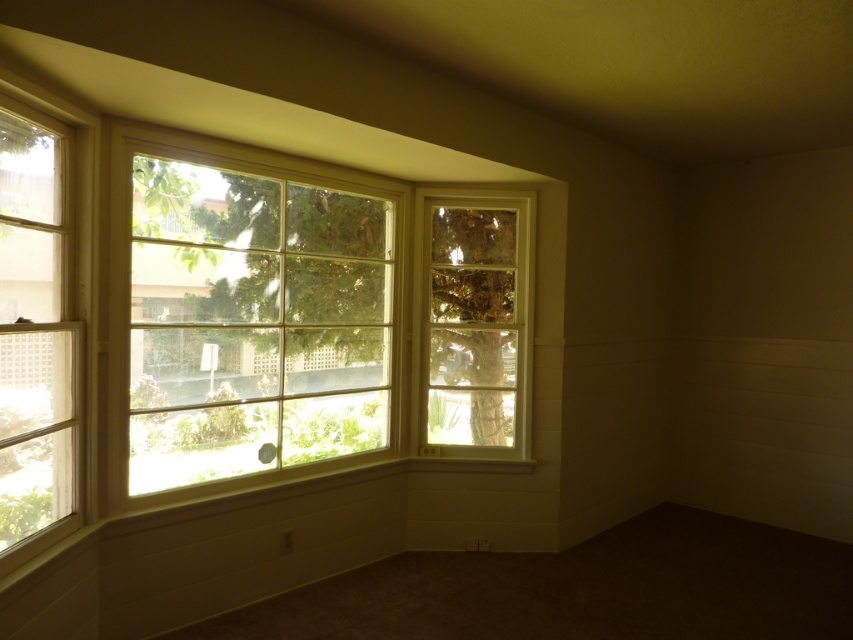
Question: Which point is farther to the camera?

Choices:
 (A) click(445, 435)
 (B) click(9, 138)
 (C) click(239, 385)

Answer: (A)

Question: Does white wood window at upper left have a lesser width compared to clear glass window at center?

Choices:
 (A) yes
 (B) no

Answer: (B)

Question: Can you confirm if white wood window at upper left is wider than clear glass window at left?

Choices:
 (A) yes
 (B) no

Answer: (A)

Question: Can you confirm if white wood window at upper left is positioned to the right of clear glass window at center?

Choices:
 (A) yes
 (B) no

Answer: (B)

Question: Which point is closer to the camera?

Choices:
 (A) (175, 157)
 (B) (70, 244)

Answer: (B)

Question: Estimate the real-world distances between objects in this image. Which object is closer to the clear glass window at left?

Choices:
 (A) clear glass window at center
 (B) white wood window at upper left

Answer: (B)